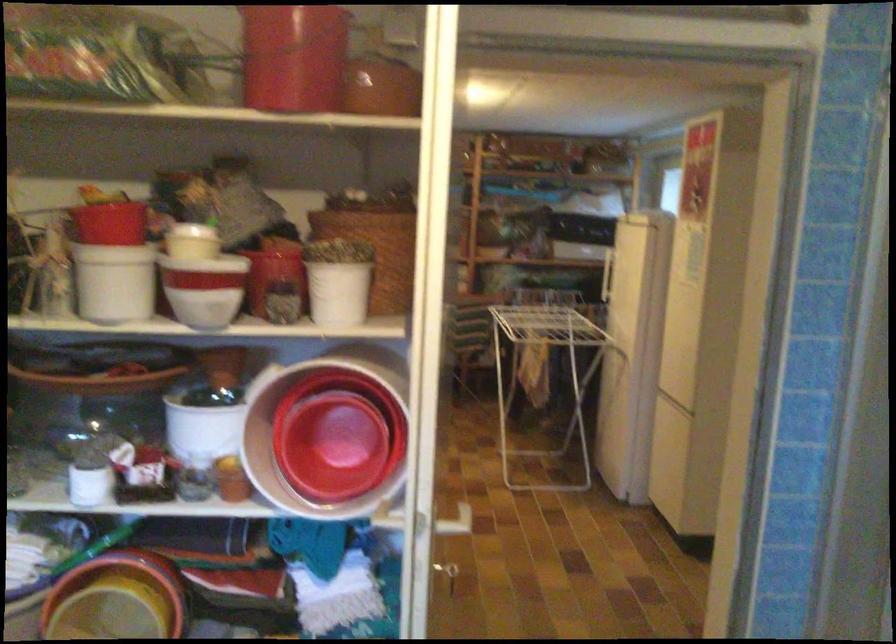
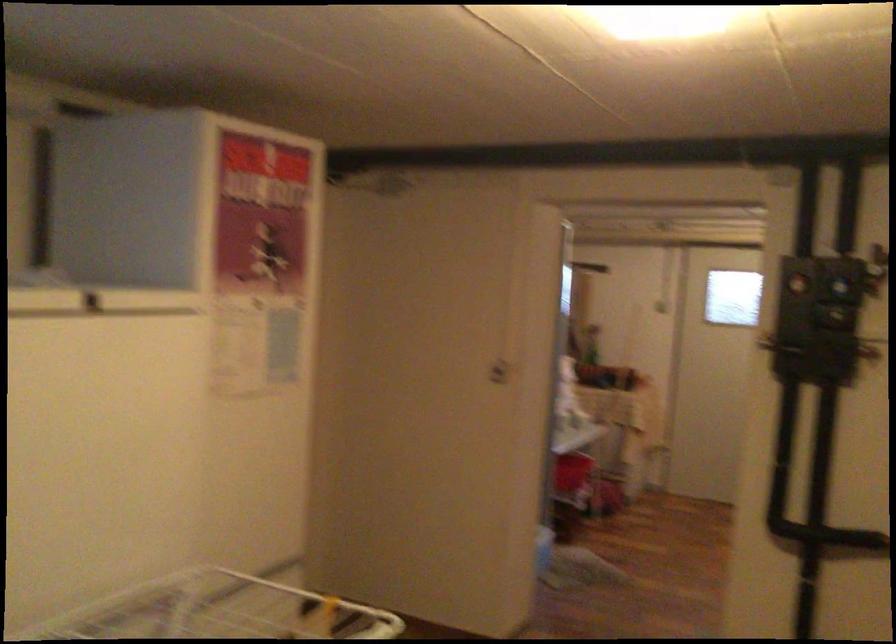
Find the pixel in the second image that matches (x=323, y=169) in the first image.

(840, 281)